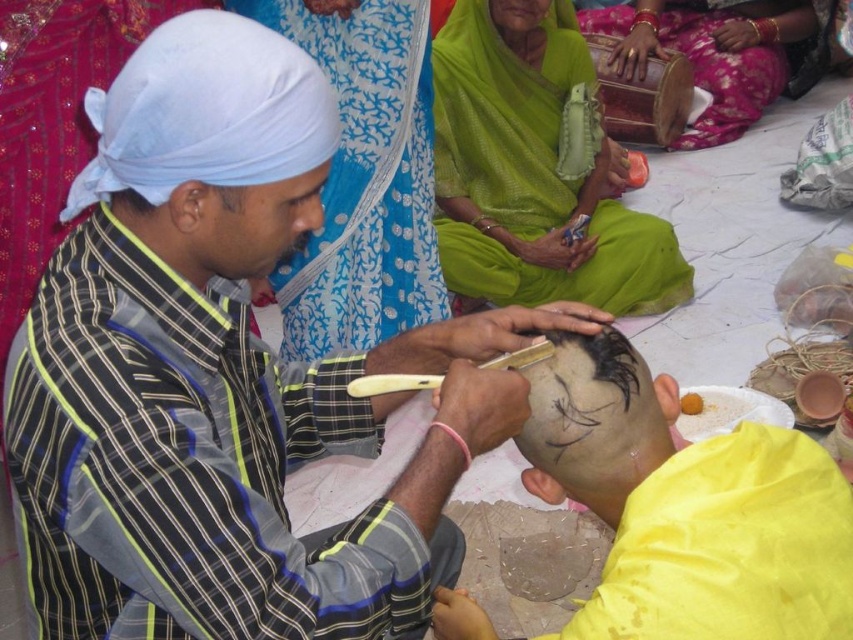
Question: Considering the real-world distances, which object is closest to the matte clay mask at center?

Choices:
 (A) smooth green fabric at center
 (B) green silk saree at upper center
 (C) smooth white turban at upper left

Answer: (C)

Question: Can you confirm if matte clay mask at center is thinner than smooth green fabric at center?

Choices:
 (A) no
 (B) yes

Answer: (A)

Question: Among these objects, which one is nearest to the camera?

Choices:
 (A) wooden drum at upper right
 (B) black hair at center
 (C) smooth white turban at upper left

Answer: (C)

Question: Which of these objects is positioned closest to the smooth green fabric at center?

Choices:
 (A) matte black head at center
 (B) smooth white turban at upper left
 (C) green silk saree at upper center

Answer: (C)

Question: Is matte black head at center behind green silk saree at upper center?

Choices:
 (A) yes
 (B) no

Answer: (B)

Question: Is matte black head at center above black hair at center?

Choices:
 (A) no
 (B) yes

Answer: (A)